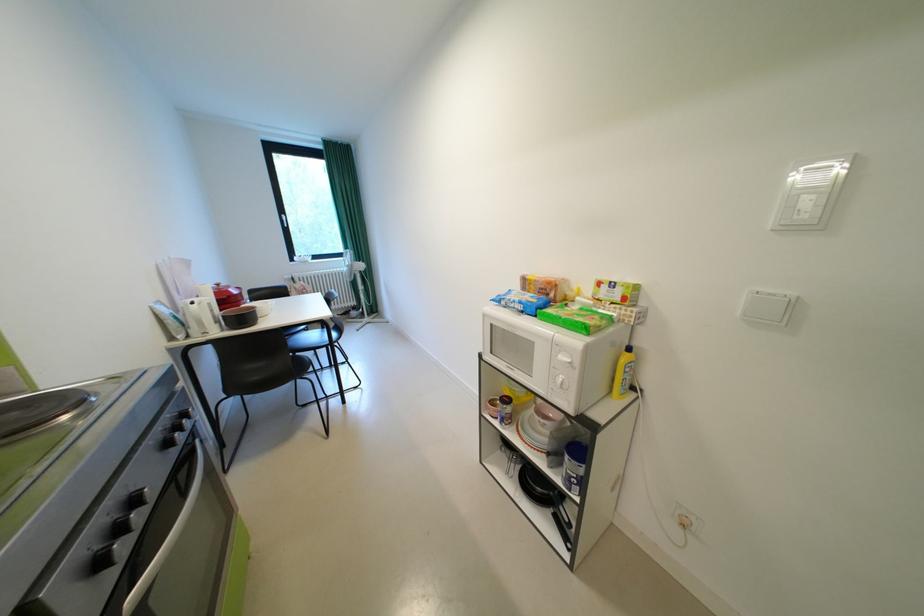
Describe the element at coordinates (538, 487) in the screenshot. The width and height of the screenshot is (924, 616). I see `a black pan handle` at that location.